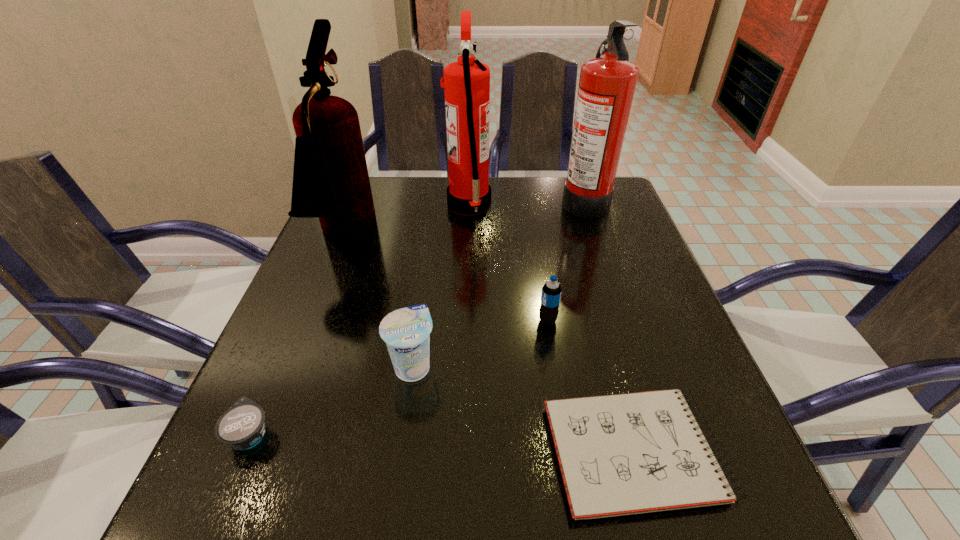
Image resolution: width=960 pixels, height=540 pixels. Find the location of `free location at the far right corner of the desktop`. free location at the far right corner of the desktop is located at coordinates (607, 220).

Identify the location of vacant space at the near right corner. This screenshot has width=960, height=540. (715, 507).

Find the location of `vacant area that lies between the soda bottle and the notepad`. vacant area that lies between the soda bottle and the notepad is located at coordinates (591, 387).

This screenshot has width=960, height=540. In order to click on vacant space in between the rightmost fire extinguisher and the notepad in this screenshot , I will do `click(610, 326)`.

The height and width of the screenshot is (540, 960). I want to click on free area in between the leftmost fire extinguisher and the farther yogurt, so click(x=379, y=301).

In order to click on vacant area that lies between the fifth farthest object and the soda bottle in this screenshot , I will do `click(480, 343)`.

Where is `free space between the soda bottle and the right yogurt`? free space between the soda bottle and the right yogurt is located at coordinates (480, 343).

Locate an element on the screen. The width and height of the screenshot is (960, 540). free point between the notepad and the second fire extinguisher from left to right is located at coordinates (552, 329).

Image resolution: width=960 pixels, height=540 pixels. What are the coordinates of `unoccupied area between the rightmost fire extinguisher and the shortest object` in the screenshot? It's located at (610, 326).

Find the location of a particular element. vacant space that is in between the second fire extinguisher from right to left and the right yogurt is located at coordinates (441, 286).